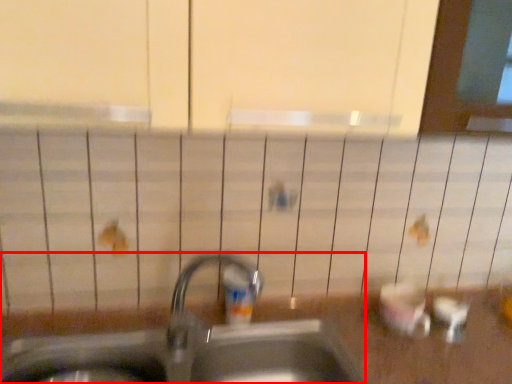
Question: From the image's perspective, where is sink (annotated by the red box) located in relation to toiletry in the image?

Choices:
 (A) below
 (B) above

Answer: (A)